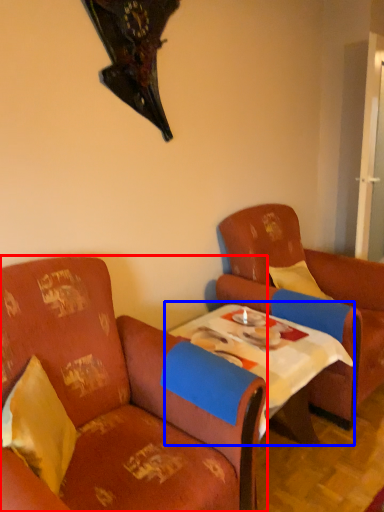
Question: Which point is closer to the camera, chair (highlighted by a red box) or table (highlighted by a blue box)?

Choices:
 (A) chair
 (B) table

Answer: (A)